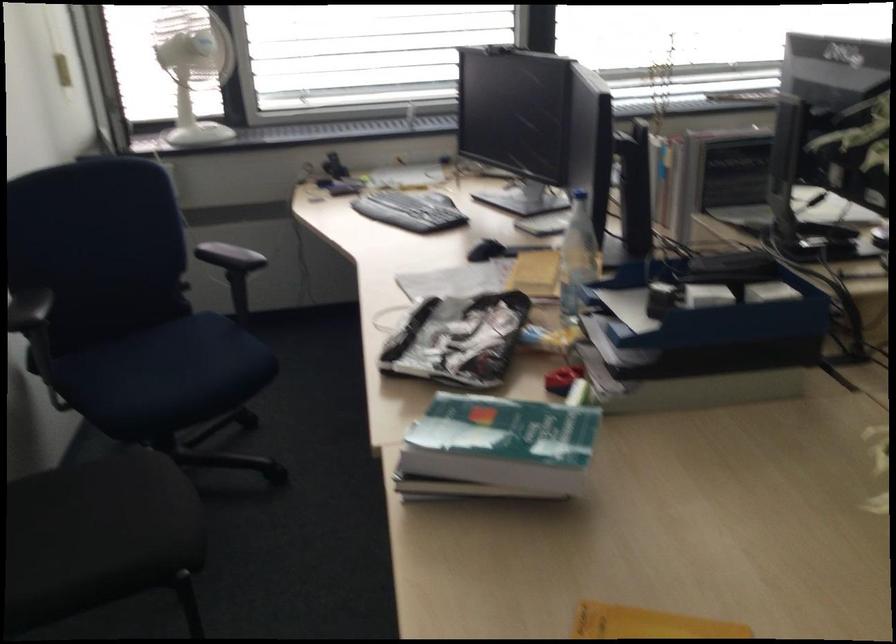
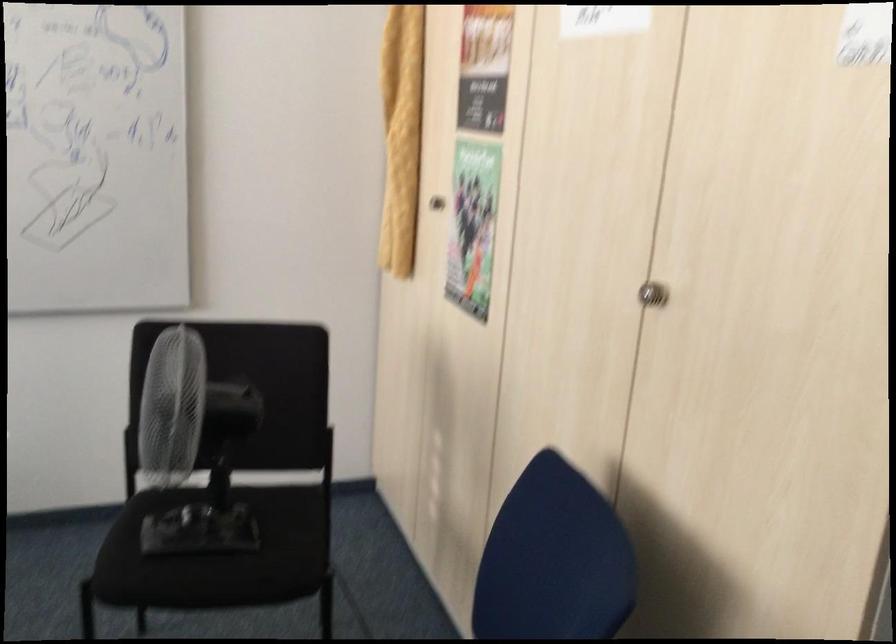
First-person continuous shooting, in which direction is the camera rotating?

The camera rotated toward right-down.